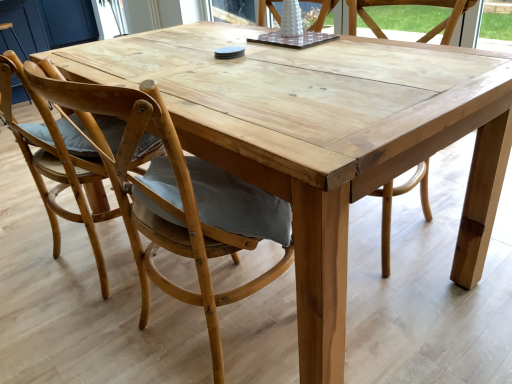
In order to face natural wood chair at center, which ranks as the 4th chair in left-to-right order, should I rotate leftwards or rightwards?

A 14.735 degree turn to the right will do.

This screenshot has width=512, height=384. What do you see at coordinates (57, 168) in the screenshot?
I see `light brown wood chair at left, which ranks as the fourth chair in right-to-left order` at bounding box center [57, 168].

This screenshot has width=512, height=384. I want to click on white matte vase at upper center, the 3th chair when ordered from left to right, so click(321, 13).

Where is `natural wood chair at center, which ranks as the 4th chair in left-to-right order`? natural wood chair at center, which ranks as the 4th chair in left-to-right order is located at coordinates (409, 4).

Is natural wood chair at center, which is counted as the 1th chair, starting from the right, facing towards white matte vase at upper center, which is the second chair in right-to-left order?

No, natural wood chair at center, which is counted as the 1th chair, starting from the right, is not turned towards white matte vase at upper center, which is the second chair in right-to-left order.

Considering the relative sizes of natural wood chair at center, which is counted as the 1th chair, starting from the right, and white matte vase at upper center, the 3th chair when ordered from left to right, in the image provided, is natural wood chair at center, which is counted as the 1th chair, starting from the right, bigger than white matte vase at upper center, the 3th chair when ordered from left to right,?

Yes, natural wood chair at center, which is counted as the 1th chair, starting from the right, is bigger than white matte vase at upper center, the 3th chair when ordered from left to right.

Which is closer to the camera, (392, 190) or (322, 16)?

Point (392, 190) appears to be closer to the viewer than point (322, 16).

From the picture: Can you confirm if natural wood chair at center, which is counted as the 1th chair, starting from the right, is shorter than white matte vase at upper center, which is the second chair in right-to-left order?

Incorrect, the height of natural wood chair at center, which is counted as the 1th chair, starting from the right, does not fall short of that of white matte vase at upper center, which is the second chair in right-to-left order.

Is point (192, 195) closer or farther from the camera than point (59, 167)?

Point (192, 195) appears to be closer to the viewer than point (59, 167).

Based on the photo, in terms of width, does natural wood chair at center, placed as the second chair when sorted from left to right, look wider or thinner when compared to light brown wood chair at left, which ranks as the fourth chair in right-to-left order?

Considering their sizes, natural wood chair at center, placed as the second chair when sorted from left to right, looks slimmer than light brown wood chair at left, which ranks as the fourth chair in right-to-left order.

Is natural wood chair at center, the third chair in the right-to-left sequence, facing towards light brown wood chair at left, acting as the 1th chair starting from the left?

No.

Considering the positions of objects natural wood chair at center, placed as the second chair when sorted from left to right, and light brown wood chair at left, which ranks as the fourth chair in right-to-left order, in the image provided, who is behind, natural wood chair at center, placed as the second chair when sorted from left to right, or light brown wood chair at left, which ranks as the fourth chair in right-to-left order,?

light brown wood chair at left, which ranks as the fourth chair in right-to-left order, is more distant.

Considering the positions of objects light brown wood chair at left, which ranks as the fourth chair in right-to-left order, and natural wood chair at center, the third chair in the right-to-left sequence, in the image provided, who is in front, light brown wood chair at left, which ranks as the fourth chair in right-to-left order, or natural wood chair at center, the third chair in the right-to-left sequence,?

natural wood chair at center, the third chair in the right-to-left sequence, is closer to the camera.

Which is more distant, (49, 211) or (48, 89)?

Point (49, 211)

Does light brown wood chair at left, which ranks as the fourth chair in right-to-left order, appear on the right side of natural wood chair at center, the third chair in the right-to-left sequence?

Incorrect, light brown wood chair at left, which ranks as the fourth chair in right-to-left order, is not on the right side of natural wood chair at center, the third chair in the right-to-left sequence.

Can we say light brown wood chair at left, which ranks as the fourth chair in right-to-left order, lies outside natural wood chair at center, placed as the second chair when sorted from left to right?

Indeed, light brown wood chair at left, which ranks as the fourth chair in right-to-left order, is completely outside natural wood chair at center, placed as the second chair when sorted from left to right.

Who is shorter, natural wood chair at center, placed as the second chair when sorted from left to right, or natural wood chair at center, which is counted as the 1th chair, starting from the right?

With less height is natural wood chair at center, placed as the second chair when sorted from left to right.

Is natural wood chair at center, the third chair in the right-to-left sequence, outside of natural wood chair at center, which ranks as the 4th chair in left-to-right order?

Yes.

Is natural wood chair at center, placed as the second chair when sorted from left to right, smaller than natural wood chair at center, which is counted as the 1th chair, starting from the right?

Indeed, natural wood chair at center, placed as the second chair when sorted from left to right, has a smaller size compared to natural wood chair at center, which is counted as the 1th chair, starting from the right.

From the natural wood chair at center, which is counted as the 1th chair, starting from the right, count 2nd chairs forward and point to it. Please provide its 2D coordinates.

[(176, 199)]

Locate an element on the screen. Image resolution: width=512 pixels, height=384 pixels. the 1st chair directly beneath the natural wood chair at center, which ranks as the 4th chair in left-to-right order (from a real-world perspective) is located at coordinates (176, 199).

Which is correct: natural wood chair at center, which is counted as the 1th chair, starting from the right, is inside natural wood chair at center, placed as the second chair when sorted from left to right, or outside of it?

natural wood chair at center, which is counted as the 1th chair, starting from the right, is spatially situated outside natural wood chair at center, placed as the second chair when sorted from left to right.

Looking at this image, which of these two, natural wood chair at center, which is counted as the 1th chair, starting from the right, or natural wood chair at center, the third chair in the right-to-left sequence, is bigger?

With larger size is natural wood chair at center, which is counted as the 1th chair, starting from the right.

From a real-world perspective, who is located higher, natural wood chair at center, which is counted as the 1th chair, starting from the right, or natural wood chair at center, placed as the second chair when sorted from left to right?

From a 3D spatial view, natural wood chair at center, which is counted as the 1th chair, starting from the right, is above.

Looking at this image, is white matte vase at upper center, the 3th chair when ordered from left to right, further to the viewer compared to natural wood chair at center, placed as the second chair when sorted from left to right?

Yes.

In the scene shown: Is white matte vase at upper center, the 3th chair when ordered from left to right, oriented away from natural wood chair at center, the third chair in the right-to-left sequence?

white matte vase at upper center, the 3th chair when ordered from left to right, does not have its back to natural wood chair at center, the third chair in the right-to-left sequence.

From the image's perspective, which is below, white matte vase at upper center, which is the second chair in right-to-left order, or natural wood chair at center, placed as the second chair when sorted from left to right?

natural wood chair at center, placed as the second chair when sorted from left to right, from the image's perspective.

Based on the photo, how far apart are white matte vase at upper center, which is the second chair in right-to-left order, and light brown wood chair at left, which ranks as the fourth chair in right-to-left order?

white matte vase at upper center, which is the second chair in right-to-left order, is 4.03 feet away from light brown wood chair at left, which ranks as the fourth chair in right-to-left order.

Which is behind, white matte vase at upper center, which is the second chair in right-to-left order, or light brown wood chair at left, acting as the 1th chair starting from the left?

white matte vase at upper center, which is the second chair in right-to-left order, is behind.

From the image's perspective, which is above, white matte vase at upper center, which is the second chair in right-to-left order, or light brown wood chair at left, acting as the 1th chair starting from the left?

white matte vase at upper center, which is the second chair in right-to-left order, from the image's perspective.

From the image's perspective, starting from the white matte vase at upper center, the 3th chair when ordered from left to right, which chair is the 1st one below? Please provide its 2D coordinates.

[(409, 4)]

I want to click on the 1st chair to the right of the light brown wood chair at left, acting as the 1th chair starting from the left, starting your count from the anchor, so click(x=176, y=199).

Which object lies nearer to the anchor point natural wood chair at center, which is counted as the 1th chair, starting from the right, white matte vase at upper center, the 3th chair when ordered from left to right, or natural wood chair at center, placed as the second chair when sorted from left to right?

white matte vase at upper center, the 3th chair when ordered from left to right, lies closer to natural wood chair at center, which is counted as the 1th chair, starting from the right, than the other object.

Based on the photo, looking at the image, which one is located further to natural wood chair at center, which is counted as the 1th chair, starting from the right, natural wood chair at center, the third chair in the right-to-left sequence, or white matte vase at upper center, which is the second chair in right-to-left order?

natural wood chair at center, the third chair in the right-to-left sequence, lies further to natural wood chair at center, which is counted as the 1th chair, starting from the right, than the other object.

Which object lies further to the anchor point natural wood chair at center, the third chair in the right-to-left sequence, light brown wood chair at left, acting as the 1th chair starting from the left, or natural wood chair at center, which is counted as the 1th chair, starting from the right?

The object further to natural wood chair at center, the third chair in the right-to-left sequence, is natural wood chair at center, which is counted as the 1th chair, starting from the right.

Based on their spatial positions, is light brown wood chair at left, acting as the 1th chair starting from the left, or natural wood chair at center, which is counted as the 1th chair, starting from the right, further from white matte vase at upper center, the 3th chair when ordered from left to right?

light brown wood chair at left, acting as the 1th chair starting from the left, lies further to white matte vase at upper center, the 3th chair when ordered from left to right, than the other object.

Based on their spatial positions, is natural wood chair at center, the third chair in the right-to-left sequence, or natural wood chair at center, which is counted as the 1th chair, starting from the right, further from white matte vase at upper center, the 3th chair when ordered from left to right?

natural wood chair at center, the third chair in the right-to-left sequence.

Estimate the real-world distances between objects in this image. Which object is further from white matte vase at upper center, the 3th chair when ordered from left to right, natural wood chair at center, which ranks as the 4th chair in left-to-right order, or light brown wood chair at left, acting as the 1th chair starting from the left?

Among the two, light brown wood chair at left, acting as the 1th chair starting from the left, is located further to white matte vase at upper center, the 3th chair when ordered from left to right.

Looking at this image, when comparing their distances from white matte vase at upper center, which is the second chair in right-to-left order, does light brown wood chair at left, which ranks as the fourth chair in right-to-left order, or natural wood chair at center, the third chair in the right-to-left sequence, seem further?

Based on the image, natural wood chair at center, the third chair in the right-to-left sequence, appears to be further to white matte vase at upper center, which is the second chair in right-to-left order.

Considering their positions, is natural wood chair at center, which is counted as the 1th chair, starting from the right, positioned further to natural wood chair at center, the third chair in the right-to-left sequence, than light brown wood chair at left, which ranks as the fourth chair in right-to-left order?

The object further to natural wood chair at center, the third chair in the right-to-left sequence, is natural wood chair at center, which is counted as the 1th chair, starting from the right.